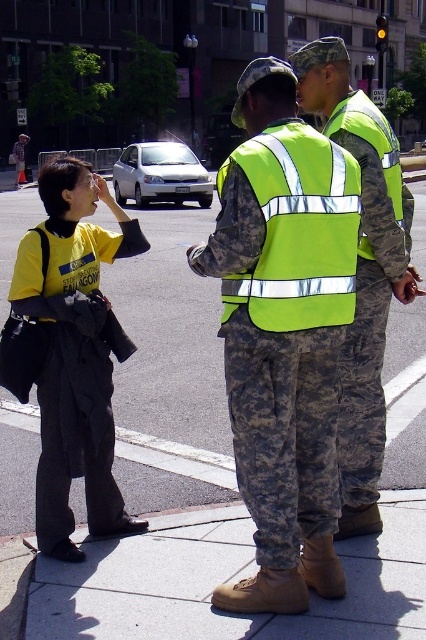
Does point (77, 173) lie in front of point (383, 141)?

Yes, point (77, 173) is closer to viewer.

Is yellow reflective vest at center above neon yellow reflective vest at center?

Incorrect, yellow reflective vest at center is not positioned above neon yellow reflective vest at center.

Which is in front, point (111, 403) or point (379, 291)?

Point (379, 291)

Where is `yellow reflective vest at center`? yellow reflective vest at center is located at coordinates (69, 353).

Can you confirm if high visibility yellow reflective vest at center is positioned above high-visibility fabric safety vest at center?

Actually, high visibility yellow reflective vest at center is below high-visibility fabric safety vest at center.

You are a GUI agent. You are given a task and a screenshot of the screen. Output one action in this format:
    pyautogui.click(x=<x>, y=<y>)
    Task: Click on the high visibility yellow reflective vest at center
    
    Given the screenshot: What is the action you would take?
    pyautogui.click(x=284, y=328)

Does gray concrete pavement at center have a larger size compared to high-visibility fabric safety vest at center?

Yes, gray concrete pavement at center is bigger than high-visibility fabric safety vest at center.

Can you confirm if gray concrete pavement at center is positioned below high-visibility fabric safety vest at center?

Actually, gray concrete pavement at center is above high-visibility fabric safety vest at center.

Find the location of a particular element. Image resolution: width=426 pixels, height=640 pixels. gray concrete pavement at center is located at coordinates (169, 372).

Find the location of a particular element. gray concrete pavement at center is located at coordinates (169, 372).